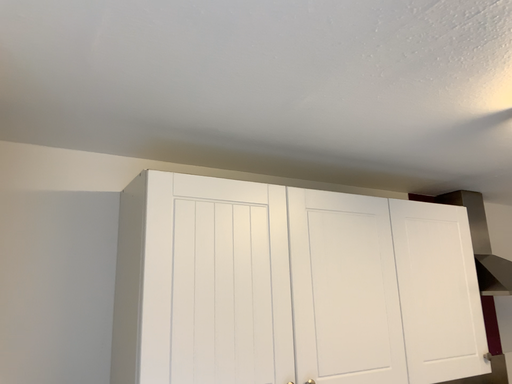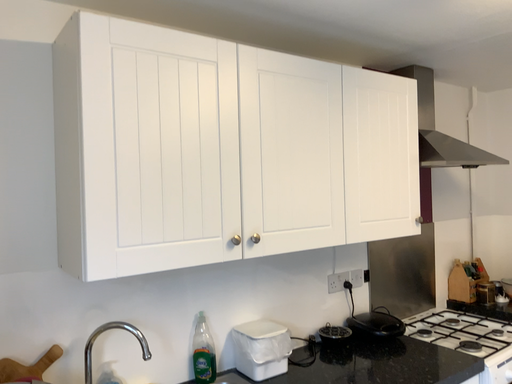
Question: Which way did the camera rotate in the video?

Choices:
 (A) rotated upward
 (B) rotated downward

Answer: (B)